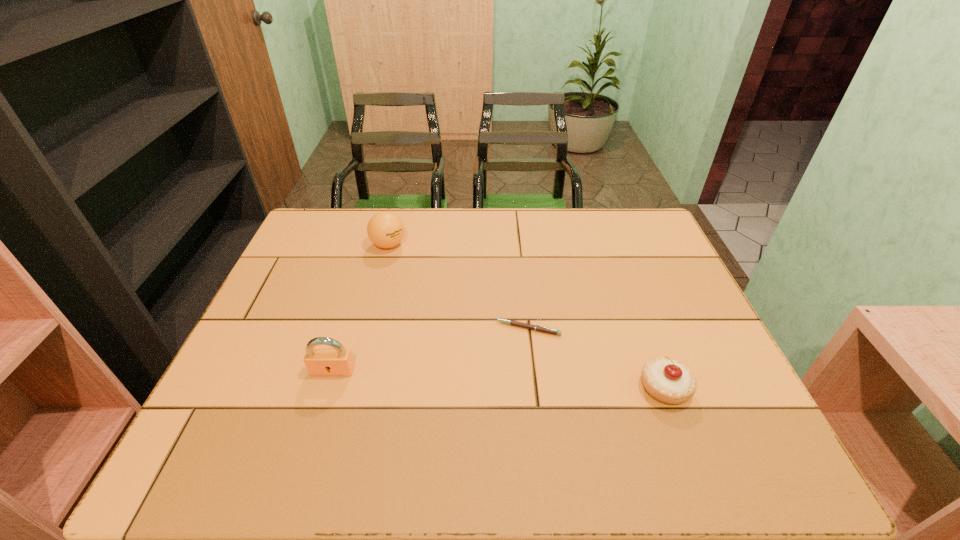
The width and height of the screenshot is (960, 540). I want to click on vacant space that satisfies the following two spatial constraints: 1. on the front side of the third tallest object; 2. on the left side of the shortest object, so click(534, 388).